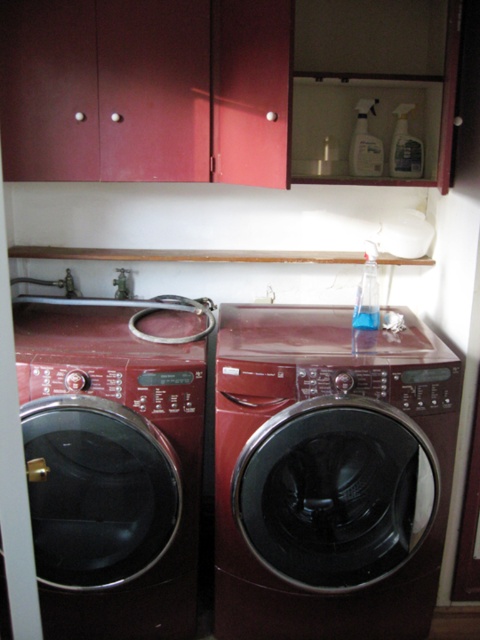
Consider the image. Which is below, clear plastic spray bottle at upper center or transparent plastic bottle at upper right?

Positioned lower is transparent plastic bottle at upper right.

Which is more to the right, clear plastic spray bottle at upper center or transparent plastic bottle at upper right?

clear plastic spray bottle at upper center is more to the right.

The height and width of the screenshot is (640, 480). Find the location of `clear plastic spray bottle at upper center`. clear plastic spray bottle at upper center is located at coordinates (364, 144).

Is point (370, 172) farther from viewer compared to point (398, 163)?

That is True.

Does clear plastic spray bottle at upper center appear on the right side of clear plastic spray bottle at upper right?

In fact, clear plastic spray bottle at upper center is to the left of clear plastic spray bottle at upper right.

What do you see at coordinates (364, 144) in the screenshot?
I see `clear plastic spray bottle at upper center` at bounding box center [364, 144].

Where is `clear plastic spray bottle at upper center`? The width and height of the screenshot is (480, 640). clear plastic spray bottle at upper center is located at coordinates (364, 144).

Can you confirm if shiny dark red washing machine at center is positioned to the left of matte black washing machine at left?

In fact, shiny dark red washing machine at center is to the right of matte black washing machine at left.

Looking at this image, does shiny dark red washing machine at center appear on the right side of matte black washing machine at left?

Indeed, shiny dark red washing machine at center is positioned on the right side of matte black washing machine at left.

What do you see at coordinates (330, 474) in the screenshot? This screenshot has height=640, width=480. I see `shiny dark red washing machine at center` at bounding box center [330, 474].

What are the coordinates of `shiny dark red washing machine at center` in the screenshot? It's located at (330, 474).